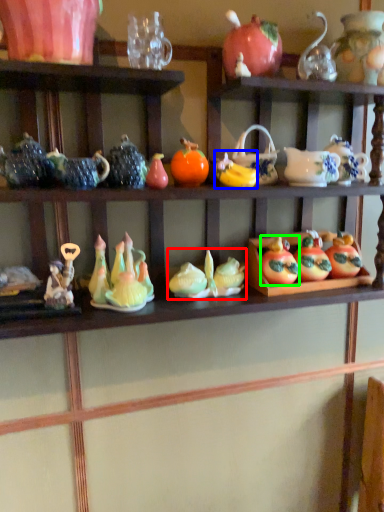
Question: Which object is positioned farthest from toy (highlighted by a red box)? Select from fruit (highlighted by a blue box) and fruit (highlighted by a green box).

Choices:
 (A) fruit
 (B) fruit

Answer: (A)